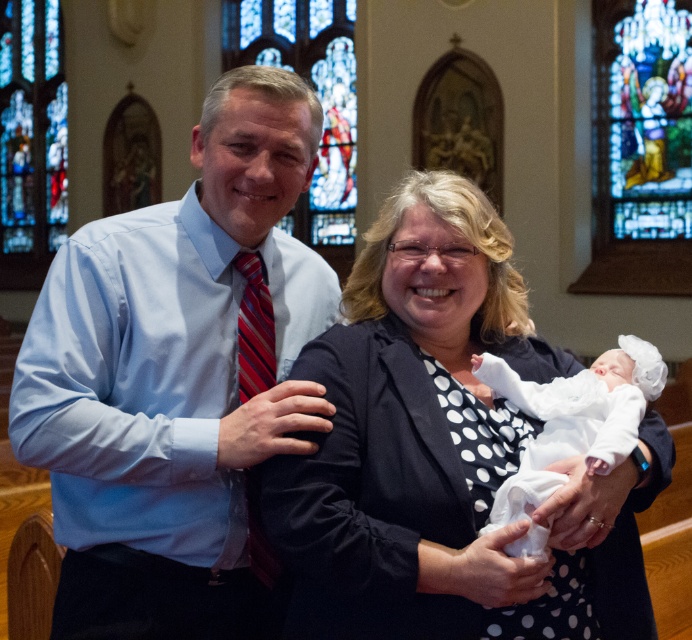
Question: Is stained glass window at upper right positioned in front of stained glass window at upper center?

Choices:
 (A) yes
 (B) no

Answer: (A)

Question: Does matte blue shirt at center appear under stained glass window at upper right?

Choices:
 (A) yes
 (B) no

Answer: (A)

Question: Which object appears farthest from the camera in this image?

Choices:
 (A) stained glass window at upper center
 (B) white satin newborn at center
 (C) matte blue shirt at center

Answer: (A)

Question: Among these points, which one is nearest to the camera?

Choices:
 (A) (473, 275)
 (B) (686, 81)
 (C) (637, 422)
 (D) (224, 42)

Answer: (C)

Question: Does matte blue shirt at center appear on the right side of stained glass window at upper right?

Choices:
 (A) yes
 (B) no

Answer: (B)

Question: Which object is closer to the camera taking this photo?

Choices:
 (A) stained glass window at upper left
 (B) white satin newborn at center
 (C) stained glass window at upper right
 (D) matte blue shirt at center

Answer: (D)